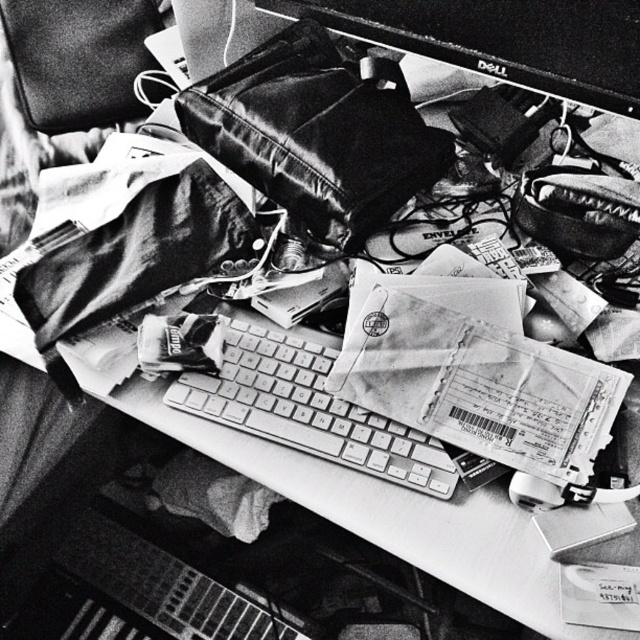
You are organizing the desk and need to place the leather bag at center and the metallic keyboard at center side by side. Which object should be placed on the left to ensure they fit within the desk space?

The leather bag at center is wider than the metallic keyboard at center, so placing the leather bag at center on the left will ensure they fit within the desk space.

You are organizing your desk and need to place the leather bag at center and the metallic keyboard at center. Given their sizes, which item should you move first to make space for the other?

Since the leather bag at center is much taller than the metallic keyboard at center, you should move the leather bag first to accommodate the keyboard, as its height might obstruct the keyboard placement.